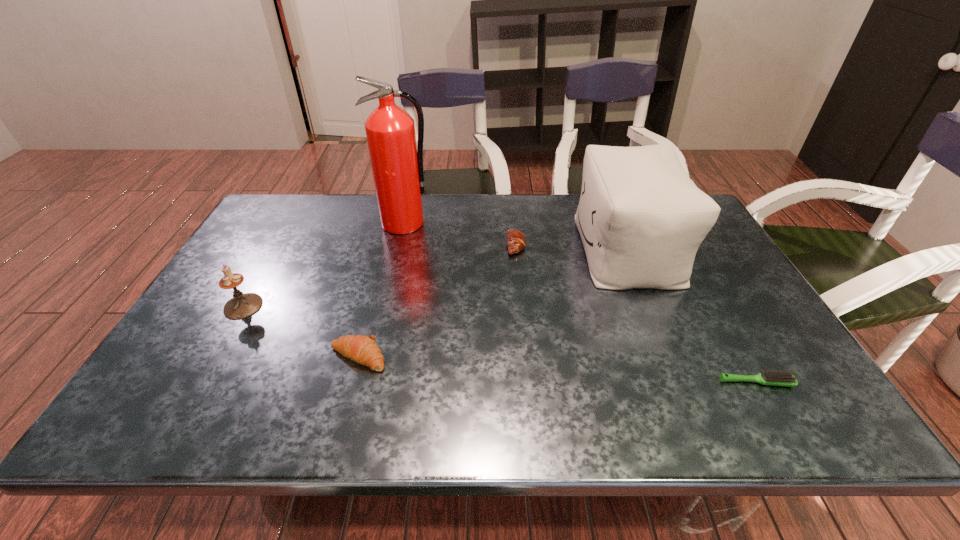
You are a GUI agent. You are given a task and a screenshot of the screen. Output one action in this format:
    pyautogui.click(x=<x>, y=<y>)
    Task: Click on the vacant region located at the nozzle of the fire extinguisher
    This screenshot has width=960, height=540.
    Given the screenshot: What is the action you would take?
    pyautogui.click(x=394, y=273)

Find the location of `vacant space situated 0.050m on the side of the cushion with the smiley face`. vacant space situated 0.050m on the side of the cushion with the smiley face is located at coordinates (563, 248).

Where is `vacant region located on the side of the cushion with the smiley face`? The width and height of the screenshot is (960, 540). vacant region located on the side of the cushion with the smiley face is located at coordinates (455, 248).

Where is `free location located 0.320m on the side of the cushion with the smiley face`? The height and width of the screenshot is (540, 960). free location located 0.320m on the side of the cushion with the smiley face is located at coordinates (472, 248).

You are a GUI agent. You are given a task and a screenshot of the screen. Output one action in this format:
    pyautogui.click(x=<x>, y=<y>)
    Task: Click on the vacant area situated on the right of the fourth farthest object
    
    Given the screenshot: What is the action you would take?
    pyautogui.click(x=382, y=306)

I want to click on vacant space situated 0.160m on the back of the left crescent roll, so click(374, 295).

Where is `free location located 0.260m on the left of the farther crescent roll`? Image resolution: width=960 pixels, height=540 pixels. free location located 0.260m on the left of the farther crescent roll is located at coordinates (420, 245).

Find the location of `free space located 0.400m on the back of the nearest object`. free space located 0.400m on the back of the nearest object is located at coordinates (688, 262).

Image resolution: width=960 pixels, height=540 pixels. Find the location of `fire extinguisher that is at the far edge`. fire extinguisher that is at the far edge is located at coordinates (397, 162).

At what (x,y) coordinates should I click in order to perform the action: click on cushion present at the far edge. Please return your answer as a coordinate pair (x, y). Looking at the image, I should click on (641, 219).